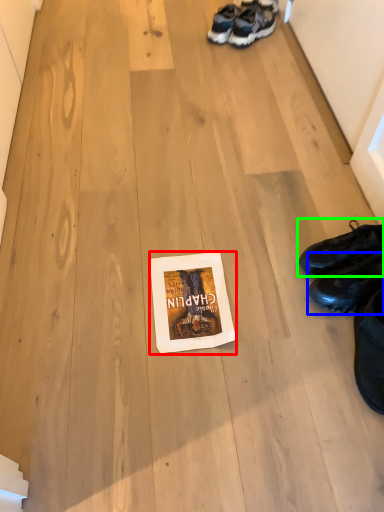
Question: Which is farther away from paperback book (highlighted by a red box)? footwear (highlighted by a blue box) or footwear (highlighted by a green box)?

Choices:
 (A) footwear
 (B) footwear

Answer: (B)